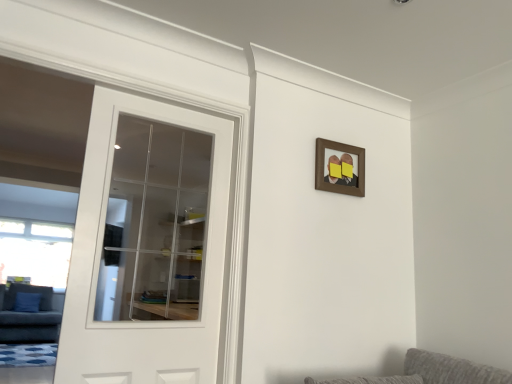
Measure the distance between point (91,165) and camera.

The distance of point (91,165) from camera is 5.85 feet.

What are the coordinates of `white glass door at left` in the screenshot? It's located at (147, 245).

Does white glass door at left turn towards dark gray fabric couch at left?

No, white glass door at left is not facing towards dark gray fabric couch at left.

Identify the location of door above the dark gray fabric couch at left (from a real-world perspective). This screenshot has width=512, height=384. (147, 245).

From the picture: Between white glass door at left and dark gray fabric couch at left, which one has larger width?

With larger width is dark gray fabric couch at left.

Is the surface of white glass door at left in direct contact with dark gray fabric couch at left?

No, white glass door at left is not touching dark gray fabric couch at left.

Would you say white glass door at left is outside brown wooden picture frame at upper center?

Yes, white glass door at left is not within brown wooden picture frame at upper center.

Between white glass door at left and brown wooden picture frame at upper center, which one has larger size?

white glass door at left is bigger.

Considering the positions of point (133, 359) and point (324, 150), is point (133, 359) closer or farther from the camera than point (324, 150)?

Point (133, 359) appears to be closer to the viewer than point (324, 150).

Does white glass door at left touch brown wooden picture frame at upper center?

No, white glass door at left is not with brown wooden picture frame at upper center.

Is dark gray fabric couch at left facing away from white glass door at left?

No, dark gray fabric couch at left is not facing away from white glass door at left.

Where is `door above the dark gray fabric couch at left (from a real-world perspective)`? door above the dark gray fabric couch at left (from a real-world perspective) is located at coordinates (147, 245).

From the image's perspective, does dark gray fabric couch at left appear higher than white glass door at left?

No, from the image's perspective, dark gray fabric couch at left is not on top of white glass door at left.

Does dark gray fabric couch at left have a lesser height compared to white glass door at left?

Yes.

Is brown wooden picture frame at upper center looking in the opposite direction of white glass door at left?

brown wooden picture frame at upper center does not have its back to white glass door at left.

Which is correct: brown wooden picture frame at upper center is inside white glass door at left, or outside of it?

brown wooden picture frame at upper center is outside white glass door at left.

Is brown wooden picture frame at upper center directly adjacent to white glass door at left?

No, brown wooden picture frame at upper center is not with white glass door at left.

How many degrees apart are the facing directions of brown wooden picture frame at upper center and dark gray fabric couch at left?

brown wooden picture frame at upper center and dark gray fabric couch at left are facing 89.8 degrees away from each other.

Is brown wooden picture frame at upper center oriented towards dark gray fabric couch at left?

No, brown wooden picture frame at upper center does not turn towards dark gray fabric couch at left.

In terms of size, does brown wooden picture frame at upper center appear bigger or smaller than dark gray fabric couch at left?

brown wooden picture frame at upper center is smaller than dark gray fabric couch at left.

Is brown wooden picture frame at upper center further to camera compared to dark gray fabric couch at left?

No, it is in front of dark gray fabric couch at left.

Can you confirm if dark gray fabric couch at left is positioned to the right of brown wooden picture frame at upper center?

No.

You are a GUI agent. You are given a task and a screenshot of the screen. Output one action in this format:
    pyautogui.click(x=<x>, y=<y>)
    Task: Click on the couch below the brown wooden picture frame at upper center (from the image's perspective)
    This screenshot has width=512, height=384.
    Given the screenshot: What is the action you would take?
    pyautogui.click(x=28, y=316)

Looking at their sizes, would you say dark gray fabric couch at left is wider or thinner than brown wooden picture frame at upper center?

Considering their sizes, dark gray fabric couch at left looks broader than brown wooden picture frame at upper center.

From a real-world perspective, is dark gray fabric couch at left below brown wooden picture frame at upper center?

Yes, from a real-world perspective, dark gray fabric couch at left is below brown wooden picture frame at upper center.

Locate an element on the screen. couch that is under the white glass door at left (from a real-world perspective) is located at coordinates (28, 316).

The height and width of the screenshot is (384, 512). Find the location of `door that appears on the left of brown wooden picture frame at upper center`. door that appears on the left of brown wooden picture frame at upper center is located at coordinates (147, 245).

Considering their positions, is dark gray fabric couch at left positioned closer to white glass door at left than brown wooden picture frame at upper center?

dark gray fabric couch at left is closer to white glass door at left.

Estimate the real-world distances between objects in this image. Which object is closer to white glass door at left, brown wooden picture frame at upper center or dark gray fabric couch at left?

dark gray fabric couch at left.

Which object lies further to the anchor point dark gray fabric couch at left, white glass door at left or brown wooden picture frame at upper center?

brown wooden picture frame at upper center is further to dark gray fabric couch at left.

Looking at the image, which one is located closer to brown wooden picture frame at upper center, white glass door at left or dark gray fabric couch at left?

The object closer to brown wooden picture frame at upper center is white glass door at left.

Estimate the real-world distances between objects in this image. Which object is further from dark gray fabric couch at left, brown wooden picture frame at upper center or white glass door at left?

brown wooden picture frame at upper center.

Which object lies nearer to the anchor point brown wooden picture frame at upper center, dark gray fabric couch at left or white glass door at left?

Based on the image, white glass door at left appears to be nearer to brown wooden picture frame at upper center.

Locate an element on the screen. This screenshot has width=512, height=384. door between dark gray fabric couch at left and brown wooden picture frame at upper center in the horizontal direction is located at coordinates (147, 245).